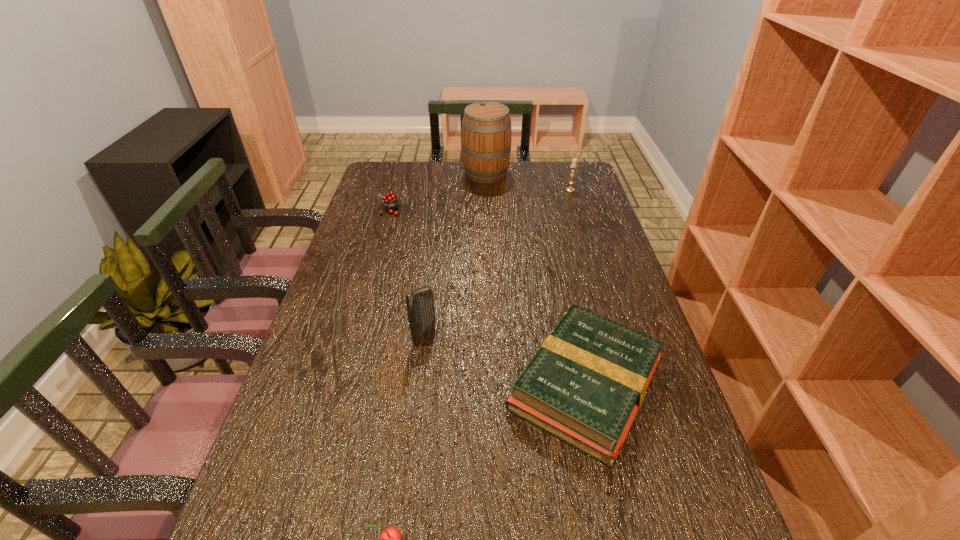
Locate which object ranks second in proximity to the fourth nearest object. Please provide its 2D coordinates. Your answer should be formatted as a tuple, i.e. [(x, y)], where the tuple contains the x and y coordinates of a point satisfying the conditions above.

[(420, 306)]

Image resolution: width=960 pixels, height=540 pixels. Identify the location of free space that satisfies the following two spatial constraints: 1. on the front side of the cider; 2. on the keyboard of the second tallest object. (490, 335).

The width and height of the screenshot is (960, 540). Identify the location of vacant space that satisfies the following two spatial constraints: 1. on the handle side of the leftmost object; 2. on the right side of the candle holder. coord(395,190).

Locate an element on the screen. This screenshot has width=960, height=540. vacant area in the image that satisfies the following two spatial constraints: 1. on the front side of the cider; 2. on the left side of the third tallest object is located at coordinates (487, 190).

This screenshot has height=540, width=960. I want to click on blank area in the image that satisfies the following two spatial constraints: 1. on the handle side of the third farthest object; 2. on the back side of the candle holder, so click(x=395, y=190).